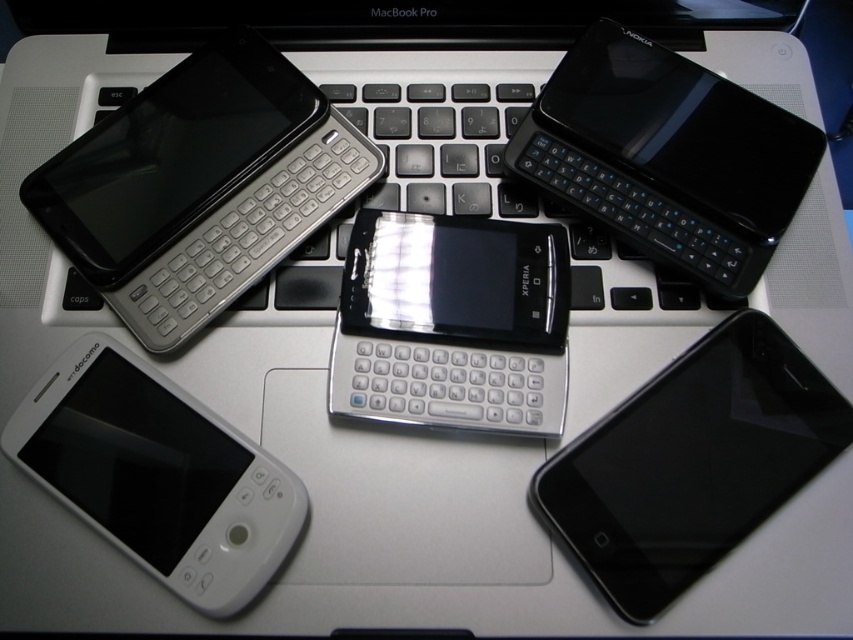
Which is more to the right, black glossy smartphone at bottom right or white matte phone at lower left?

From the viewer's perspective, black glossy smartphone at bottom right appears more on the right side.

Is point (670, 566) closer to viewer compared to point (166, 484)?

Yes.

I want to click on black glossy smartphone at bottom right, so click(x=691, y=461).

Can you confirm if black glossy smartphone at bottom right is positioned to the right of matte silver phone at upper left?

Correct, you'll find black glossy smartphone at bottom right to the right of matte silver phone at upper left.

Can you confirm if black glossy smartphone at bottom right is thinner than matte silver phone at upper left?

A: Yes, black glossy smartphone at bottom right is thinner than matte silver phone at upper left.

Who is more forward, (653, 515) or (91, 280)?

Point (653, 515)

This screenshot has height=640, width=853. Find the location of `black glossy smartphone at bottom right`. black glossy smartphone at bottom right is located at coordinates (691, 461).

Between silver metallic keyboard at center and black glossy nokia phone at upper right, which one is positioned higher?

black glossy nokia phone at upper right is higher up.

Who is more distant from viewer, (790, 109) or (670, 188)?

The point (790, 109) is more distant.

Locate an element on the screen. silver metallic keyboard at center is located at coordinates (454, 180).